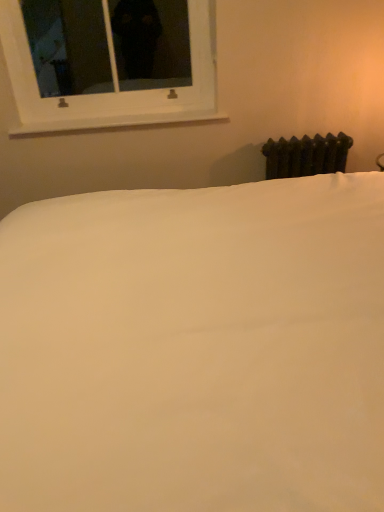
Question: Is white smooth bed at center positioned in front of white smooth window sill at upper center?

Choices:
 (A) yes
 (B) no

Answer: (A)

Question: Considering the relative positions of white smooth bed at center and white smooth window sill at upper center in the image provided, is white smooth bed at center to the right of white smooth window sill at upper center from the viewer's perspective?

Choices:
 (A) yes
 (B) no

Answer: (A)

Question: Does white smooth bed at center come behind white smooth window sill at upper center?

Choices:
 (A) yes
 (B) no

Answer: (B)

Question: Considering the relative sizes of white smooth bed at center and white smooth window sill at upper center in the image provided, is white smooth bed at center smaller than white smooth window sill at upper center?

Choices:
 (A) no
 (B) yes

Answer: (A)

Question: Is white smooth bed at center positioned beyond the bounds of white smooth window sill at upper center?

Choices:
 (A) no
 (B) yes

Answer: (B)

Question: From a real-world perspective, is white smooth bed at center positioned over white smooth window sill at upper center based on gravity?

Choices:
 (A) yes
 (B) no

Answer: (B)

Question: From a real-world perspective, does white smooth bed at center stand above white plastic window at upper left?

Choices:
 (A) yes
 (B) no

Answer: (B)

Question: Can you confirm if white smooth bed at center is positioned to the left of white plastic window at upper left?

Choices:
 (A) no
 (B) yes

Answer: (A)

Question: Can white plastic window at upper left be found inside white smooth bed at center?

Choices:
 (A) no
 (B) yes

Answer: (A)

Question: Is white smooth bed at center in front of white plastic window at upper left?

Choices:
 (A) yes
 (B) no

Answer: (A)

Question: Can you confirm if white smooth bed at center is positioned to the right of white plastic window at upper left?

Choices:
 (A) yes
 (B) no

Answer: (A)

Question: Is white smooth bed at center outside white plastic window at upper left?

Choices:
 (A) yes
 (B) no

Answer: (A)

Question: Would you consider dark green cast iron radiator at right to be distant from white plastic window at upper left?

Choices:
 (A) yes
 (B) no

Answer: (B)